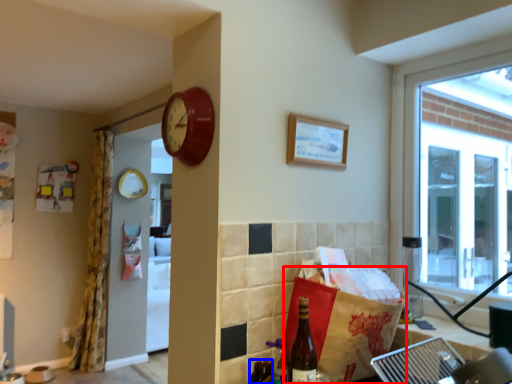
Question: Which object appears closest to the camera in this image, shopping bag (highlighted by a red box) or bottle (highlighted by a blue box)?

Choices:
 (A) shopping bag
 (B) bottle

Answer: (A)